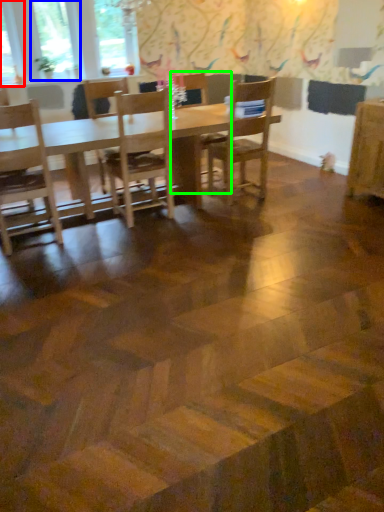
Question: Estimate the real-world distances between objects in this image. Which object is closer to window (highlighted by a red box), window (highlighted by a blue box) or chair (highlighted by a green box)?

Choices:
 (A) window
 (B) chair

Answer: (A)